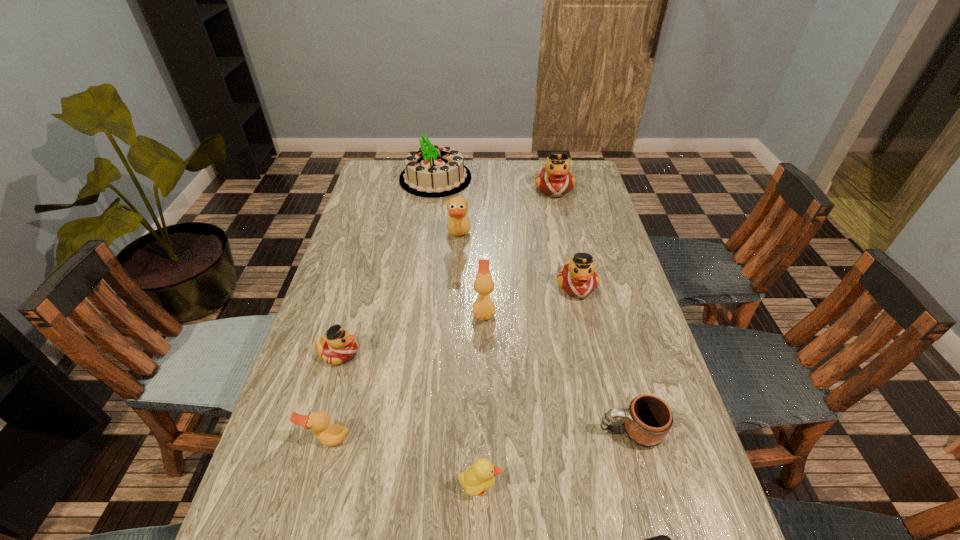
The height and width of the screenshot is (540, 960). Identify the location of birthday cake that is at the left edge. (431, 171).

You are a GUI agent. You are given a task and a screenshot of the screen. Output one action in this format:
    pyautogui.click(x=<x>, y=<y>)
    Task: Click on the mug that is positioned at the right edge
    The image size is (960, 540).
    Given the screenshot: What is the action you would take?
    tap(648, 419)

You are a GUI agent. You are given a task and a screenshot of the screen. Output one action in this format:
    pyautogui.click(x=<x>, y=<y>)
    Task: Click on the object at the far left corner
    This screenshot has height=540, width=960.
    Given the screenshot: What is the action you would take?
    pyautogui.click(x=431, y=171)

In order to click on object that is at the far right corner in this screenshot , I will do pyautogui.click(x=555, y=180).

Identify the location of vacant area at the far edge. (468, 164).

You are a GUI agent. You are given a task and a screenshot of the screen. Output one action in this format:
    pyautogui.click(x=<x>, y=<y>)
    Task: Click on the free space at the left edge of the desktop
    
    Given the screenshot: What is the action you would take?
    pyautogui.click(x=386, y=203)

This screenshot has height=540, width=960. In the image, there is a desktop. Find the location of `vacant space at the right edge`. vacant space at the right edge is located at coordinates (648, 342).

You are a GUI agent. You are given a task and a screenshot of the screen. Output one action in this format:
    pyautogui.click(x=<x>, y=<y>)
    Task: Click on the blank region between the duckling and the mug
    The height and width of the screenshot is (540, 960).
    Given the screenshot: What is the action you would take?
    pyautogui.click(x=555, y=459)

The height and width of the screenshot is (540, 960). Identify the location of vacant area between the nearest tan duck and the mug. (479, 435).

Find the location of a particular element. This screenshot has width=960, height=540. free space between the mug and the farthest red duck is located at coordinates (592, 310).